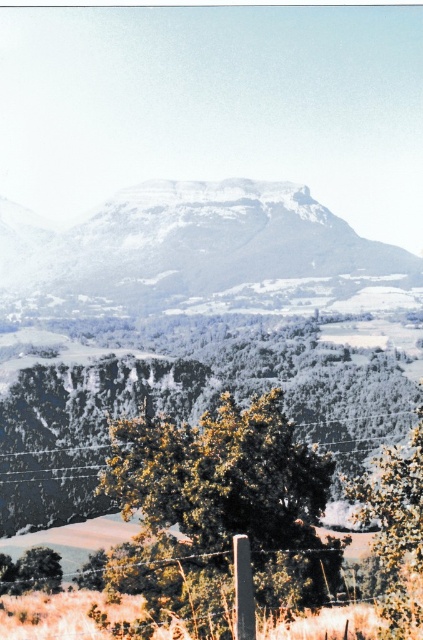
Question: Among these objects, which one is farthest from the camera?

Choices:
 (A) green matte tree at lower right
 (B) green leafy tree at center

Answer: (B)

Question: Which point is closer to the camera?

Choices:
 (A) (224, 240)
 (B) (417, 465)
 (C) (186, 564)

Answer: (B)

Question: Does green leafy tree at center appear under white snow-covered mountain at center?

Choices:
 (A) no
 (B) yes

Answer: (B)

Question: Is green leafy tree at center in front of green matte tree at lower right?

Choices:
 (A) yes
 (B) no

Answer: (B)

Question: Does green leafy tree at center appear under green matte tree at lower right?

Choices:
 (A) yes
 (B) no

Answer: (B)

Question: Which object appears closest to the camera in this image?

Choices:
 (A) green matte tree at lower right
 (B) green leafy tree at center
 (C) white snow-covered mountain at center

Answer: (A)